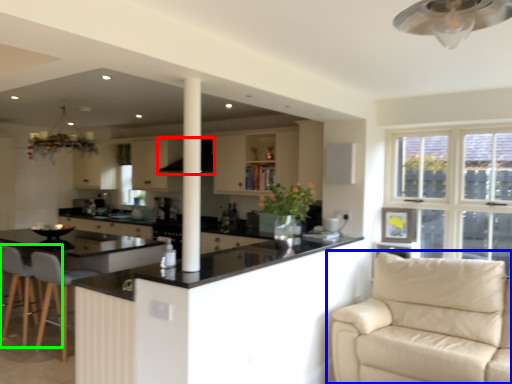
Question: Which object is the closest to the exhaust hood (highlighted by a red box)? Choose among these: studio couch (highlighted by a blue box) or swivel chair (highlighted by a green box).

Choices:
 (A) studio couch
 (B) swivel chair

Answer: (B)